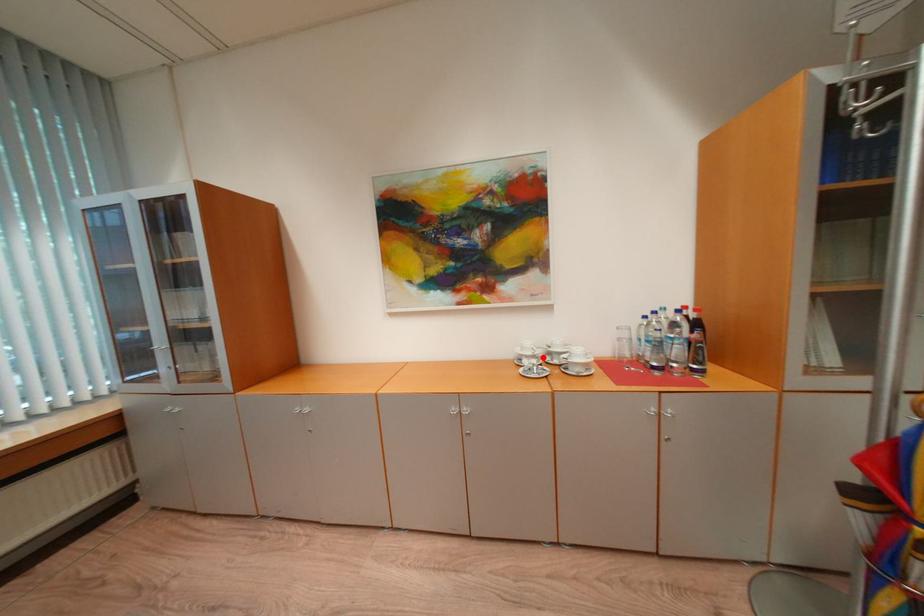
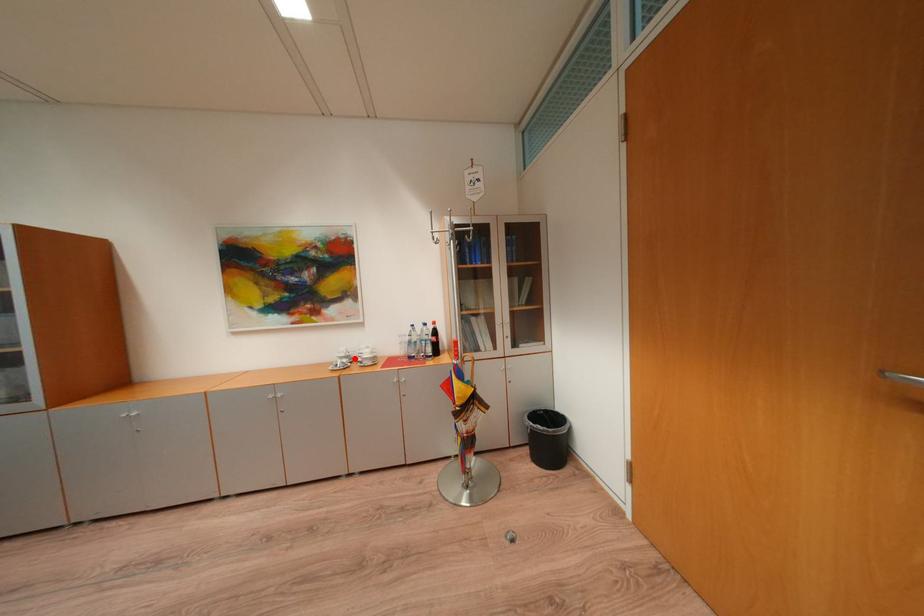
I am providing you with two images of the same scene from different viewpoints. A red point is marked on the first image and another point is marked on the second image. Is the red point in image1 aligned with the point shown in image2?

Yes